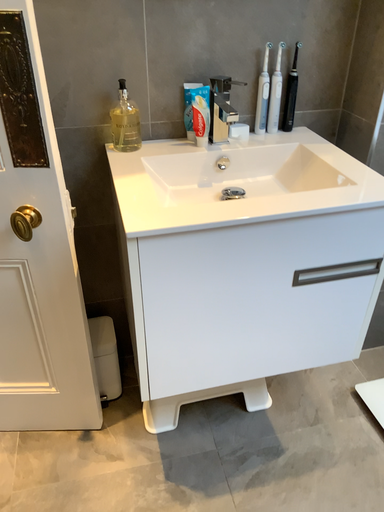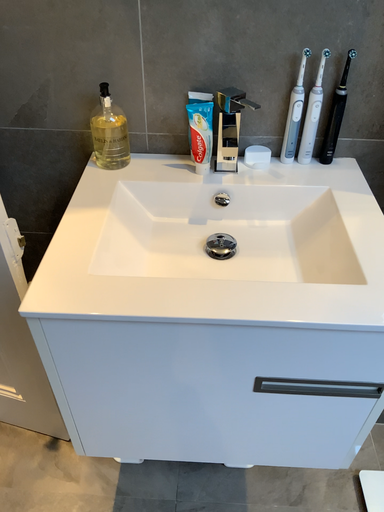
Question: How did the camera likely rotate when shooting the video?

Choices:
 (A) rotated left
 (B) rotated right

Answer: (A)